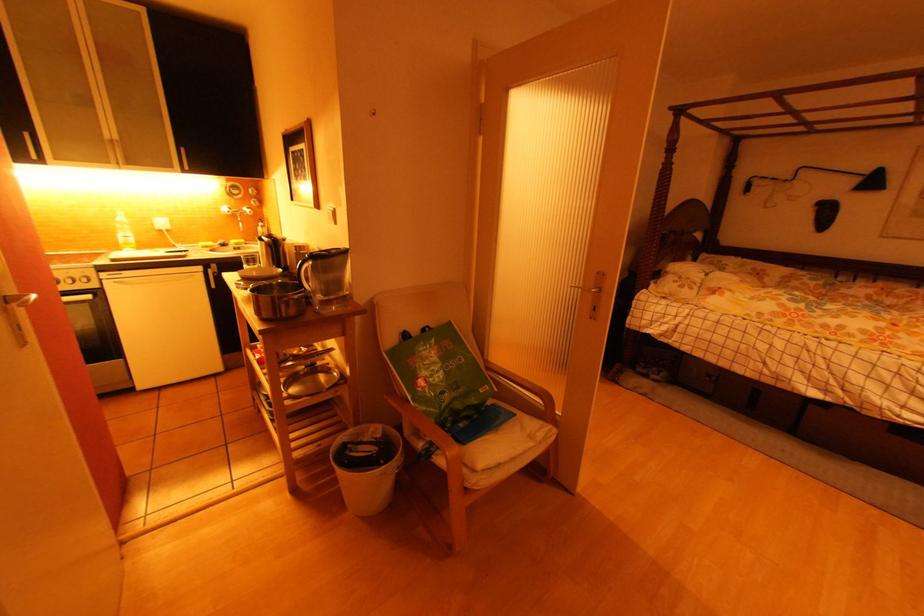
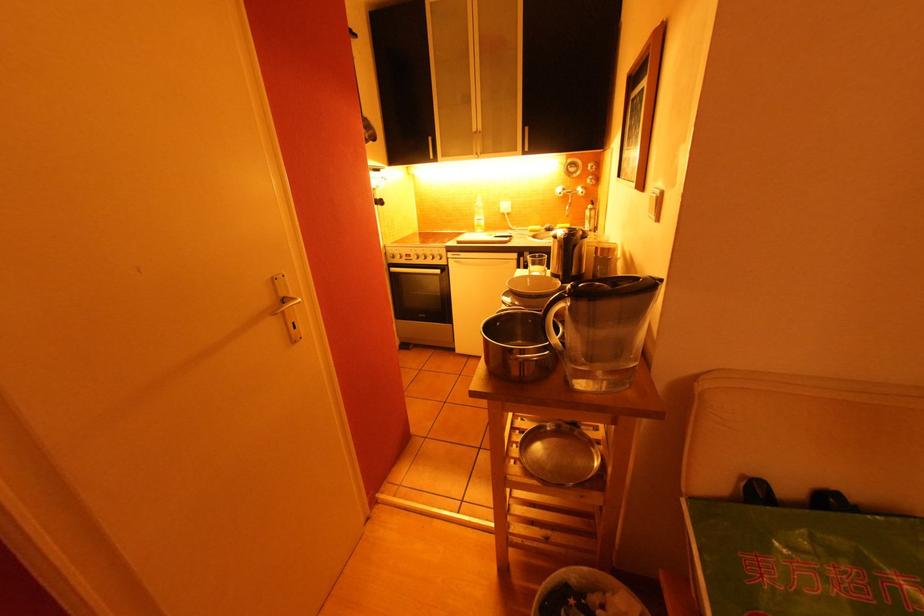
Locate, in the second image, the point that corresponds to the point at 249,208 in the first image.

(582, 187)